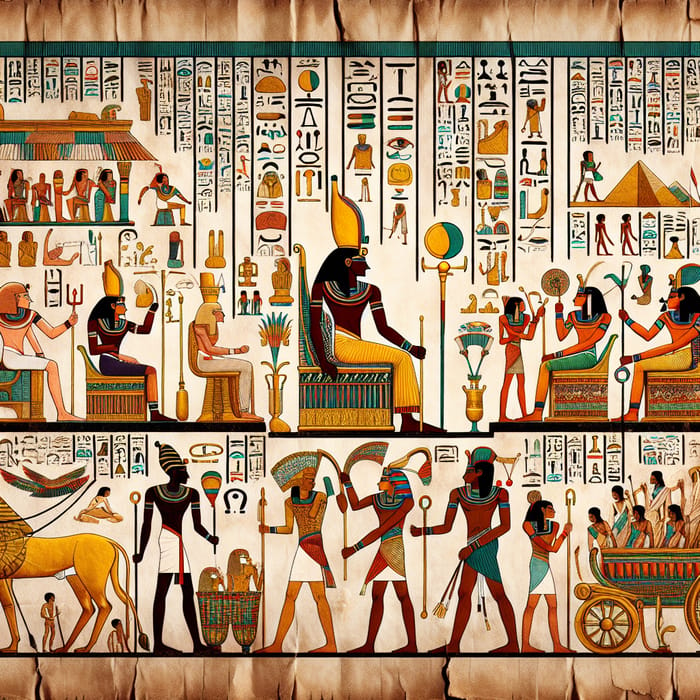
The width and height of the screenshot is (700, 700). Identify the location of chair. (164, 218).